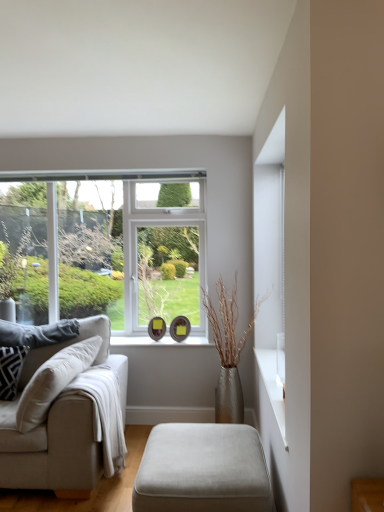
Question: Would you say patterned fabric pillow on the left, the first pillow viewed from the front, is inside or outside beige fabric couch at left?

Choices:
 (A) outside
 (B) inside

Answer: (B)

Question: In terms of height, does patterned fabric pillow on the left, the first pillow viewed from the front, look taller or shorter compared to beige fabric couch at left?

Choices:
 (A) short
 (B) tall

Answer: (A)

Question: Which is nearer to the beige fabric couch at left?

Choices:
 (A) gray fabric pillow at left, which is the 1th pillow in back-to-front order
 (B) white plastic window at center
 (C) suede ottoman at lower center
 (D) patterned fabric pillow on the left, the first pillow viewed from the front
 (E) white glossy window sill at center

Answer: (D)

Question: Based on their relative distances, which object is nearer to the white glossy window sill at center?

Choices:
 (A) beige fabric couch at left
 (B) patterned fabric pillow on the left, the first pillow viewed from the front
 (C) gray fabric pillow at left, the 2th pillow in the front-to-back sequence
 (D) suede ottoman at lower center
 (E) white plastic window at center

Answer: (C)